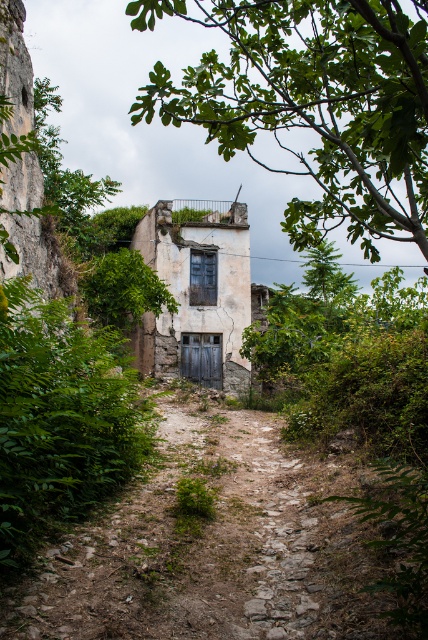
From the picture: You are standing in front of the abandoned building and want to take a photo of both the green leafy bush at center and the green leafy tree at center. Which one should you focus on first to ensure both are in clear view?

You should focus on the green leafy bush at center first since it is closer to you than the green leafy tree at center, allowing both to be in focus when using a camera with depth of field.

Consider the image. You are standing in front of the weathered stone building at center and looking towards the green leafy tree at upper center. Which object is higher in the scene?

The green leafy tree at upper center is taller than the weathered stone building at center, so the green leafy tree at upper center is higher in the scene.